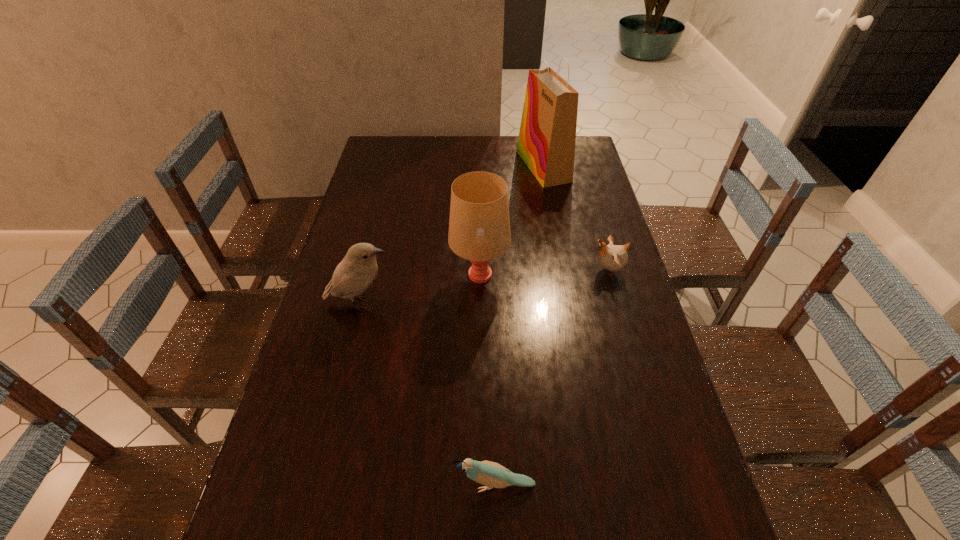
At what (x,y) coordinates should I click in order to perform the action: click on bird that is at the right edge. Please return your answer as a coordinate pair (x, y). The width and height of the screenshot is (960, 540). Looking at the image, I should click on (612, 257).

Where is `object located in the far right corner section of the desktop`? The width and height of the screenshot is (960, 540). object located in the far right corner section of the desktop is located at coordinates (546, 143).

Find the location of a particular element. This screenshot has width=960, height=540. vacant area at the far edge is located at coordinates click(x=418, y=141).

Where is `vacant space at the left edge`? Image resolution: width=960 pixels, height=540 pixels. vacant space at the left edge is located at coordinates (345, 392).

In the image, there is a desktop. At what (x,y) coordinates should I click in order to perform the action: click on vacant space at the right edge. Please return your answer as a coordinate pair (x, y). The height and width of the screenshot is (540, 960). Looking at the image, I should click on (559, 187).

Where is `free spot between the lampshade and the rightmost bird`? Image resolution: width=960 pixels, height=540 pixels. free spot between the lampshade and the rightmost bird is located at coordinates tap(543, 273).

Where is `unoccupied position between the rightmost bird and the leftmost bird`? unoccupied position between the rightmost bird and the leftmost bird is located at coordinates (484, 287).

Where is `free space between the fourth shortest object and the leftmost bird`? Image resolution: width=960 pixels, height=540 pixels. free space between the fourth shortest object and the leftmost bird is located at coordinates (420, 289).

Find the location of a particular element. The height and width of the screenshot is (540, 960). empty space that is in between the farthest bird and the second tallest object is located at coordinates (543, 273).

This screenshot has height=540, width=960. Find the location of `vacant point located between the tallest bird and the farthest bird`. vacant point located between the tallest bird and the farthest bird is located at coordinates (484, 287).